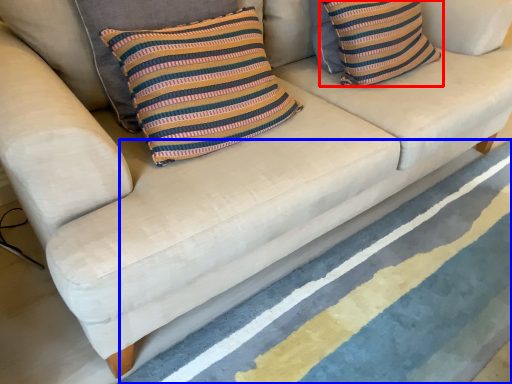
Question: Which object is closer to the camera taking this photo, pillow (highlighted by a red box) or stripe (highlighted by a blue box)?

Choices:
 (A) pillow
 (B) stripe

Answer: (B)